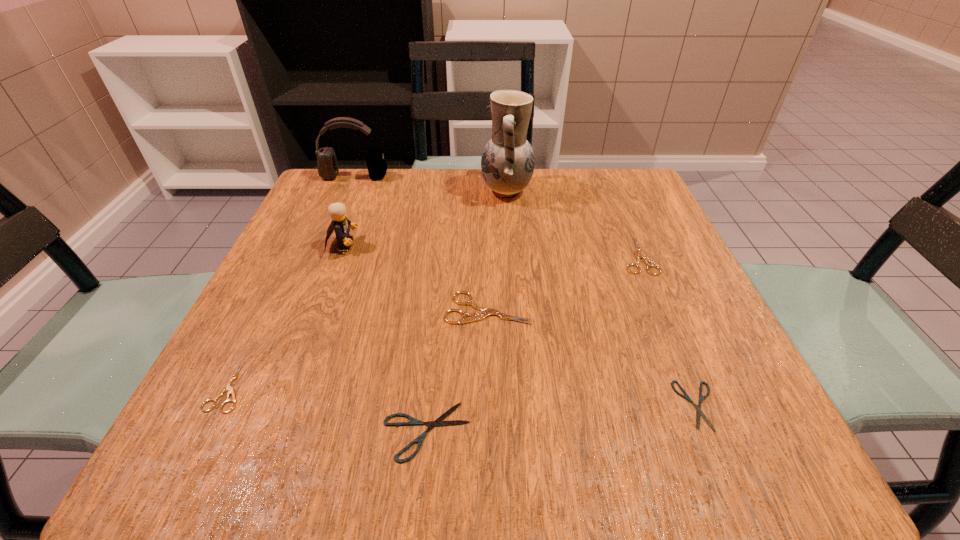
The width and height of the screenshot is (960, 540). Find the location of `pottery`. pottery is located at coordinates (507, 163).

At what (x,y) coordinates should I click in order to perform the action: click on black headset. Please return your answer as a coordinate pair (x, y). Looking at the image, I should click on (328, 169).

The width and height of the screenshot is (960, 540). What are the coordinates of `the second tallest object` in the screenshot? It's located at (328, 169).

In order to click on Lego in this screenshot , I will do `click(340, 224)`.

At what (x,y) coordinates should I click in order to perform the action: click on the fourth nearest shears. Please return your answer as a coordinate pair (x, y). Image resolution: width=960 pixels, height=540 pixels. Looking at the image, I should click on (475, 316).

Locate an element on the screen. the tallest shears is located at coordinates (475, 316).

The width and height of the screenshot is (960, 540). What are the coordinates of `the second biggest beige shears` in the screenshot? It's located at point(638,255).

At what (x,y) coordinates should I click in order to perform the action: click on the farthest beige shears. Please return your answer as a coordinate pair (x, y). This screenshot has width=960, height=540. Looking at the image, I should click on (638, 255).

This screenshot has width=960, height=540. Find the location of `the nearest beige shears`. the nearest beige shears is located at coordinates (227, 387).

In order to click on the leftmost shears in this screenshot , I will do `click(227, 387)`.